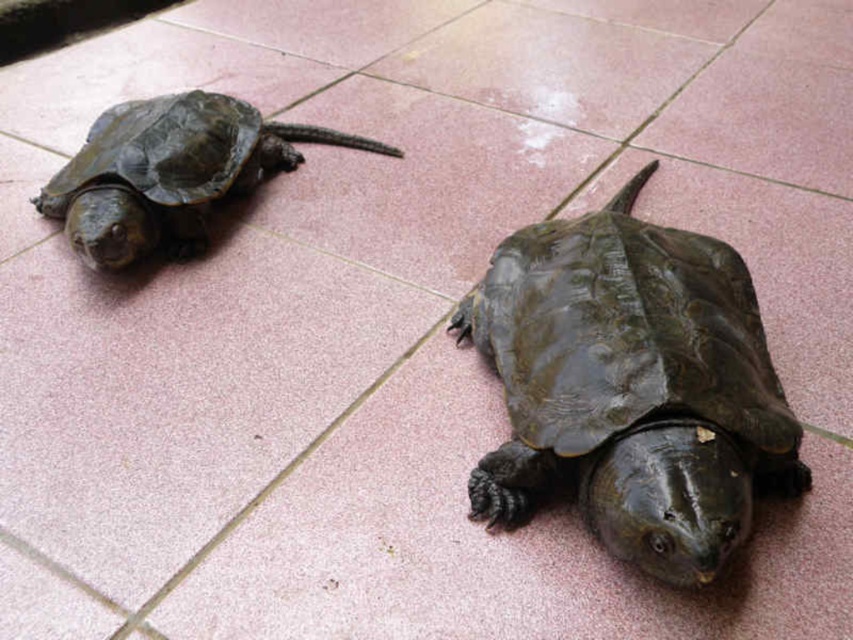
Is shiny dark green tortoise at center bigger than shiny dark green tortoise at left?

Yes, shiny dark green tortoise at center is bigger than shiny dark green tortoise at left.

Between point (680, 323) and point (183, 227), which one is positioned behind?

Point (183, 227)

Find the location of a particular element. This screenshot has width=853, height=640. shiny dark green tortoise at center is located at coordinates (631, 385).